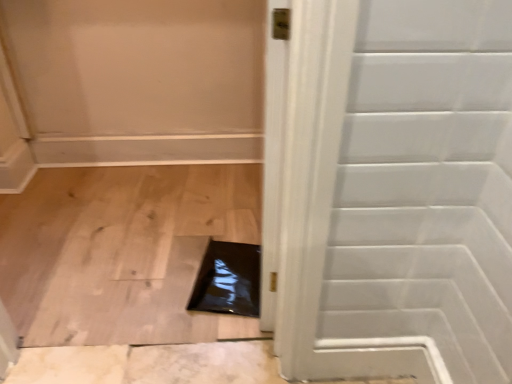
The height and width of the screenshot is (384, 512). Identify the location of free space to the back side of black glossy hole at center. (218, 222).